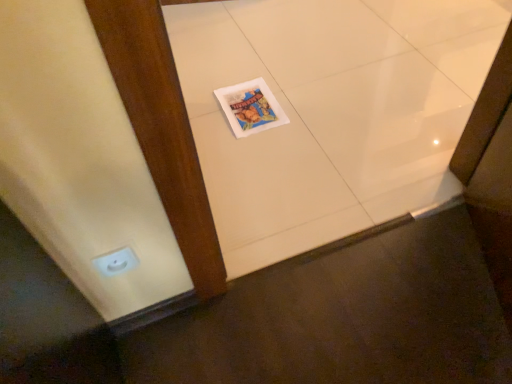
The width and height of the screenshot is (512, 384). In order to click on vacant space situated above matte paper magazine at center (from a real-world perspective) in this screenshot , I will do click(253, 101).